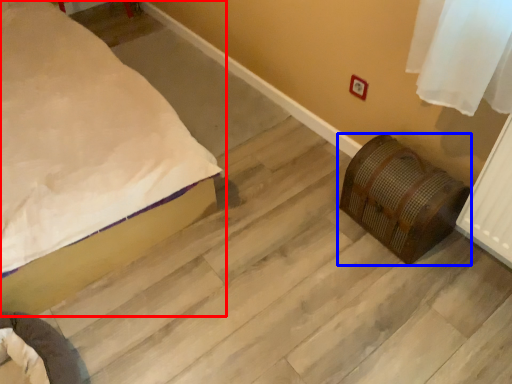
Question: Which of the following is the closest to the observer, bed (highlighted by a red box) or furniture (highlighted by a blue box)?

Choices:
 (A) bed
 (B) furniture

Answer: (A)